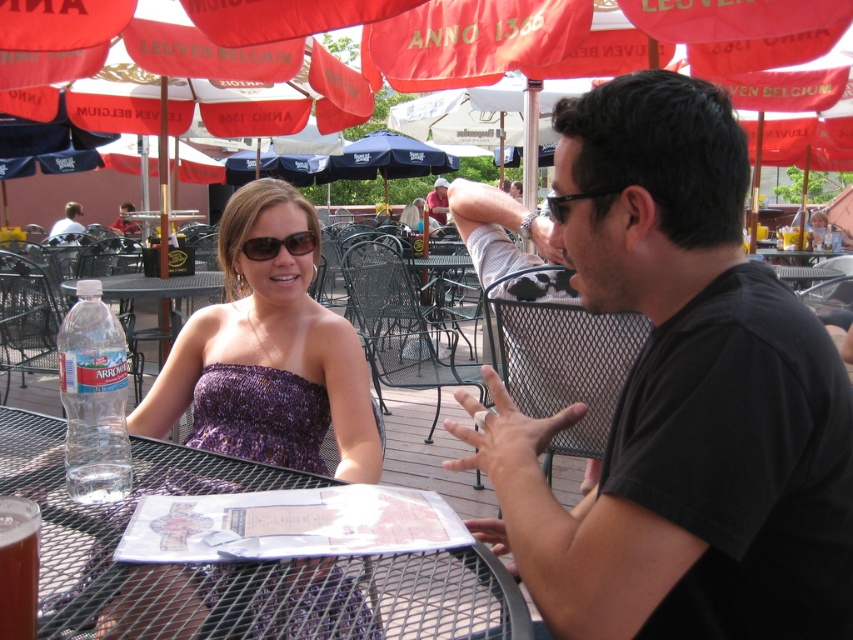
You are a photographer positioned at the back of the scene. You want to take a photo of both the black matte shirt at center and the matte pink shirt at center. Which shirt will appear larger in your photo?

The black matte shirt at center will appear larger in the photo because it is closer to the viewer than the matte pink shirt at center.

From the picture: You are a photographer trying to capture a candid shot of the person wearing the matte black shirt at upper left. You notice the matte black sunglasses at center might be blocking your view. Is the sunglasses positioned to the left or right of the shirt?

The matte black sunglasses at center are to the right of the matte black shirt at upper left, so they are positioned to the right of the shirt and may block the view.